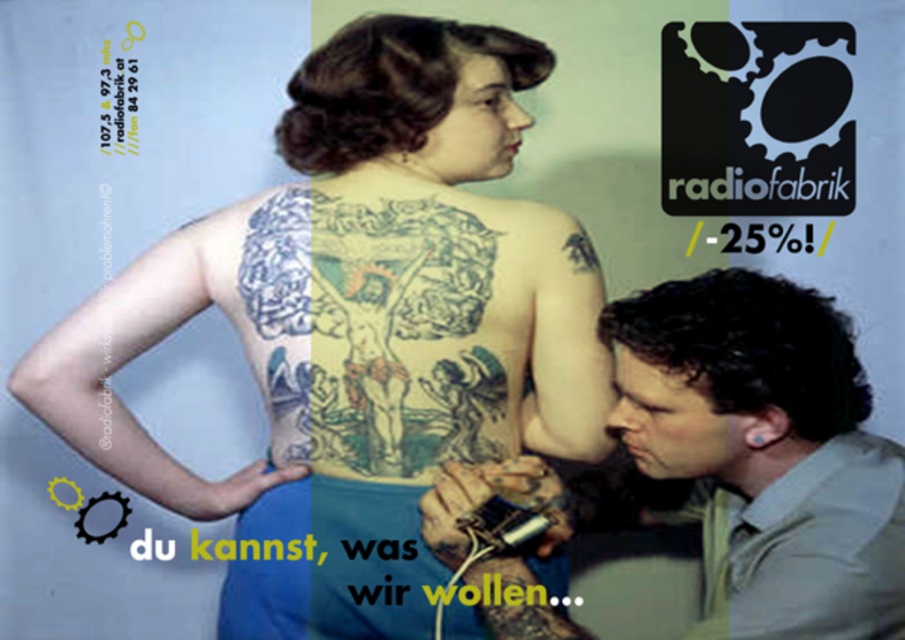
You are a photographer standing in front of the camera. You want to place the matte gray shirt at lower right exactly 1 meter away from the camera. Based on the scene, is the current distance sufficient? Please explain.

The matte gray shirt at lower right and camera are 98.82 centimeters apart. Since 98.82 cm is less than 1 meter, the current distance is insufficient. You need to move the matte gray shirt at lower right approximately 1.18 centimeters further away from the camera to reach exactly 1 meter.

In the radiofabrik advertisement, you see a matte gray shirt at lower right and a black ink bird at upper center. Which object is larger in size?

The matte gray shirt at lower right is bigger than the black ink bird at upper center.

You are an artist analyzing the promotional advertisement for radiofabrik. You notice the matte gray shirt at lower right and the blue fabric tattoo at upper left. Which object occupies a larger vertical space in the image?

The matte gray shirt at lower right has a greater height compared to the blue fabric tattoo at upper left, so the matte gray shirt at lower right occupies a larger vertical space in the image.